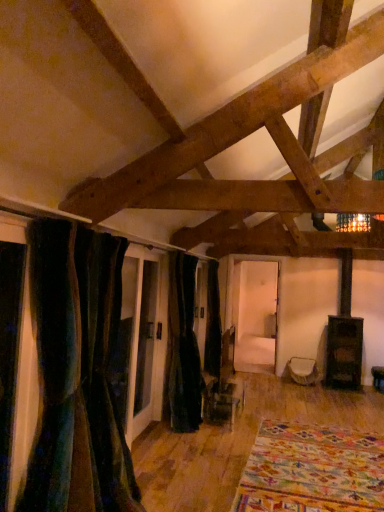
Question: From a real-world perspective, relative to multicolored woven rug at lower right, is velvet dark green curtain at center, which is counted as the first curtain, starting from the back, vertically above or below?

Choices:
 (A) below
 (B) above

Answer: (B)

Question: Is velvet dark green curtain at center, which is counted as the first curtain, starting from the back, wider or thinner than multicolored woven rug at lower right?

Choices:
 (A) wide
 (B) thin

Answer: (B)

Question: Which object is the farthest from the velvet dark green curtain at center, which is counted as the first curtain, starting from the back?

Choices:
 (A) velvet dark green curtain at left, which appears as the second curtain when viewed from the back
 (B) multicolored woven rug at lower right
 (C) white fabric ottoman at center

Answer: (C)

Question: Based on their relative distances, which object is nearer to the velvet dark green curtain at center, the 2th curtain in the front-to-back sequence?

Choices:
 (A) velvet dark green curtain at left, which is counted as the first curtain, starting from the front
 (B) multicolored woven rug at lower right
 (C) white fabric ottoman at center

Answer: (B)